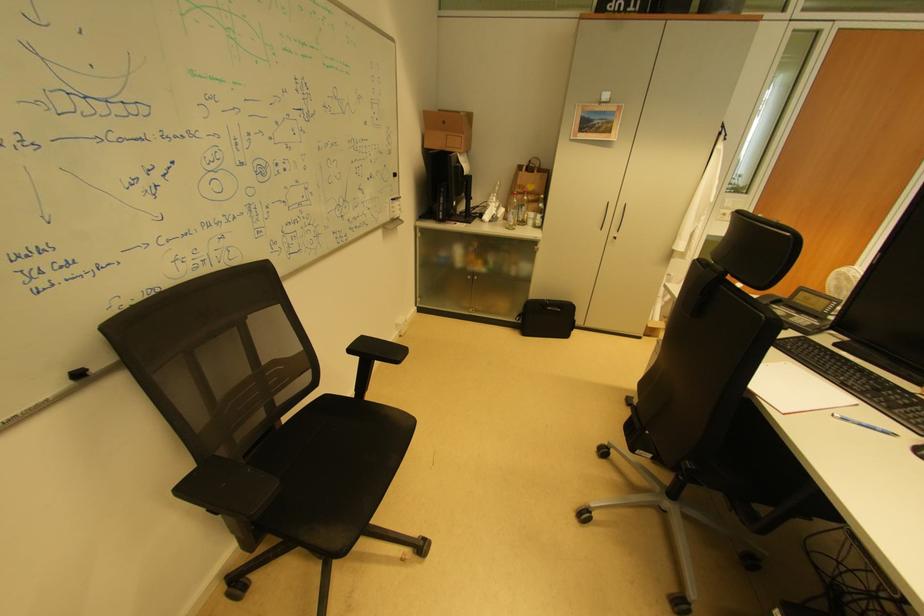
Which object does [446,130] point to?

It refers to a cardboard box.